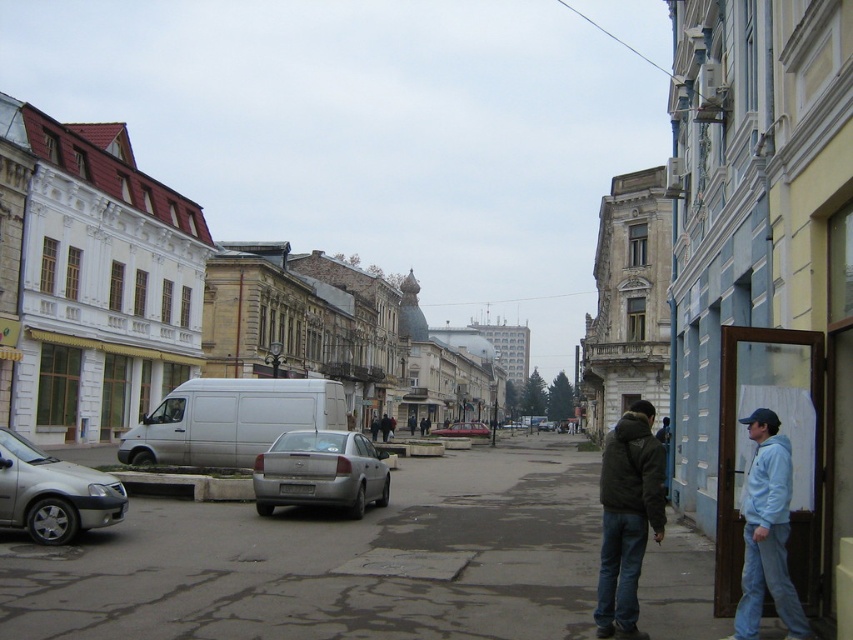
Question: Among these objects, which one is farthest from the camera?

Choices:
 (A) dark brown leather jacket at lower right
 (B) silver metallic sedan at lower left
 (C) matte silver sedan at center
 (D) light blue hoodie at lower right

Answer: (C)

Question: Can you confirm if silver metallic sedan at lower left is bigger than matte silver sedan at center?

Choices:
 (A) no
 (B) yes

Answer: (A)

Question: Which of the following is the closest to the observer?

Choices:
 (A) dark blue jacket at center
 (B) silver metallic sedan at lower left
 (C) matte silver sedan at center

Answer: (B)

Question: Can you confirm if silver metallic sedan at lower left is positioned to the right of matte silver sedan at center?

Choices:
 (A) no
 (B) yes

Answer: (A)

Question: Estimate the real-world distances between objects in this image. Which object is farther from the matte silver sedan at center?

Choices:
 (A) dark blue jacket at center
 (B) light blue hoodie at lower right

Answer: (B)

Question: Can you confirm if silver metallic sedan at lower left is smaller than matte silver sedan at center?

Choices:
 (A) yes
 (B) no

Answer: (A)